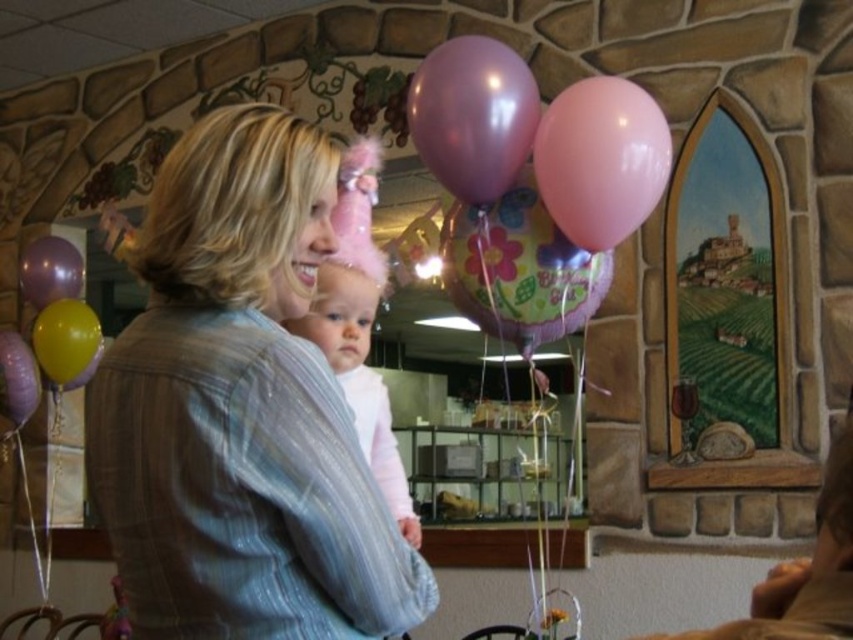
Question: Observing the image, what is the correct spatial positioning of matte gray jacket at center in reference to matte yellow balloon at left?

Choices:
 (A) left
 (B) right

Answer: (B)

Question: Which object is farther from the camera taking this photo?

Choices:
 (A) pastel pink fabric at center
 (B) matte purple balloon at left
 (C) matte gray jacket at center

Answer: (B)

Question: Which point appears closest to the camera in this image?

Choices:
 (A) (485, 42)
 (B) (45, 253)
 (C) (88, 362)
 (D) (636, 93)

Answer: (D)

Question: Considering the real-world distances, which object is farthest from the matte yellow balloon at left?

Choices:
 (A) matte purple balloon at left
 (B) pink glossy balloon at upper center
 (C) purple glossy balloon at center
 (D) pastel pink fabric at center

Answer: (B)

Question: Is pink glossy balloon at upper center thinner than pastel pink fabric at center?

Choices:
 (A) no
 (B) yes

Answer: (A)

Question: Can you confirm if pink glossy balloon at upper center is bigger than pastel pink fabric at center?

Choices:
 (A) no
 (B) yes

Answer: (A)